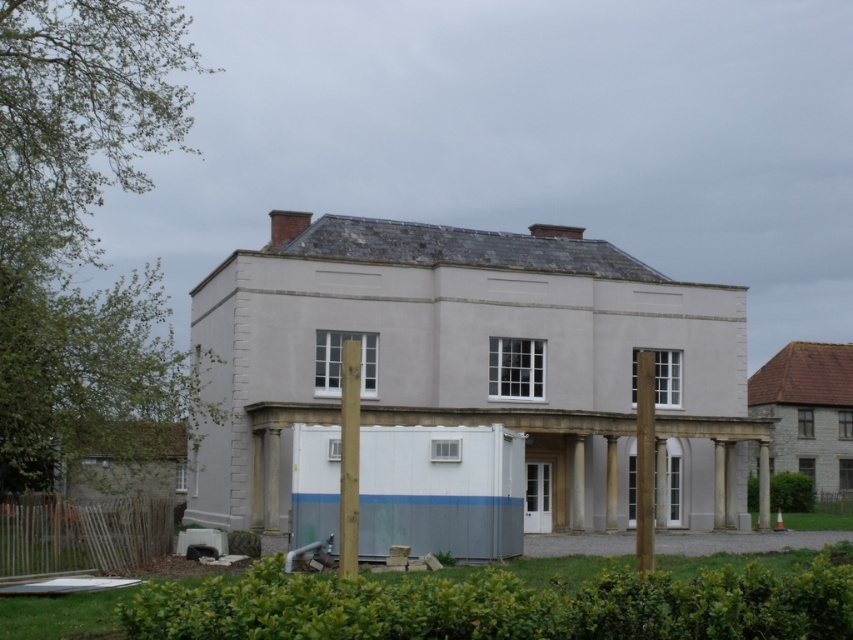
Is white stone pillar at center wider than white stone column at center?

No, white stone pillar at center is not wider than white stone column at center.

Is point (613, 452) positioned behind point (758, 442)?

That is False.

Between point (607, 499) and point (769, 483), which one is positioned behind?

Positioned behind is point (769, 483).

Identify the location of white stone pillar at center. Image resolution: width=853 pixels, height=640 pixels. (611, 483).

Is green leafy hedge at lower center above brown wooden post at right?

No.

Which is behind, point (469, 611) or point (651, 531)?

Point (651, 531)

The width and height of the screenshot is (853, 640). I want to click on green leafy hedge at lower center, so click(x=500, y=605).

Is green leafy hedge at right to the right of white smooth pillar at center from the viewer's perspective?

Indeed, green leafy hedge at right is positioned on the right side of white smooth pillar at center.

Which is in front, point (747, 508) or point (575, 490)?

Point (575, 490)

Find the location of a particular element. This screenshot has height=640, width=853. green leafy hedge at right is located at coordinates (791, 492).